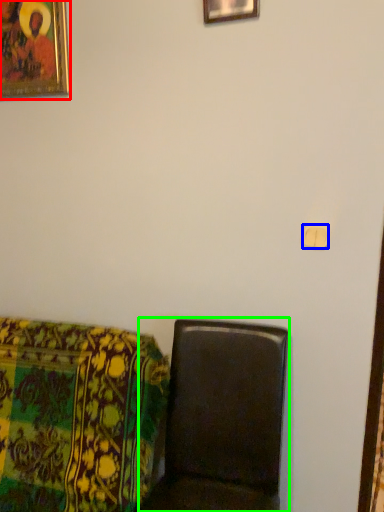
Question: Considering the real-world distances, which object is closest to picture frame (highlighted by a red box)? light switch (highlighted by a blue box) or furniture (highlighted by a green box).

Choices:
 (A) light switch
 (B) furniture

Answer: (A)